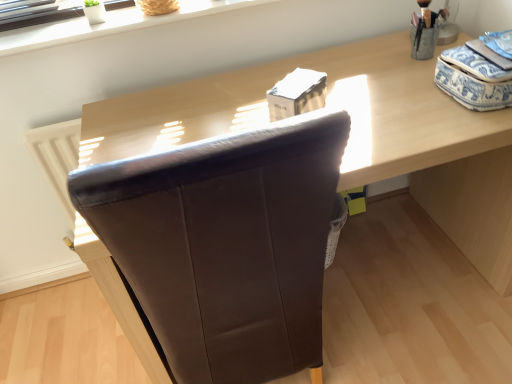
Question: Is point (207, 9) closer or farther from the camera than point (369, 46)?

Choices:
 (A) closer
 (B) farther

Answer: (A)

Question: Would you say white smooth window sill at upper center is to the left or to the right of brown leather chair at center in the picture?

Choices:
 (A) left
 (B) right

Answer: (A)

Question: Which object is positioned closest to the brown leather chair at center?

Choices:
 (A) white smooth window sill at upper center
 (B) brown leather chair at center

Answer: (A)

Question: Which object is the farthest from the white smooth window sill at upper center?

Choices:
 (A) brown leather chair at center
 (B) brown leather chair at center

Answer: (A)